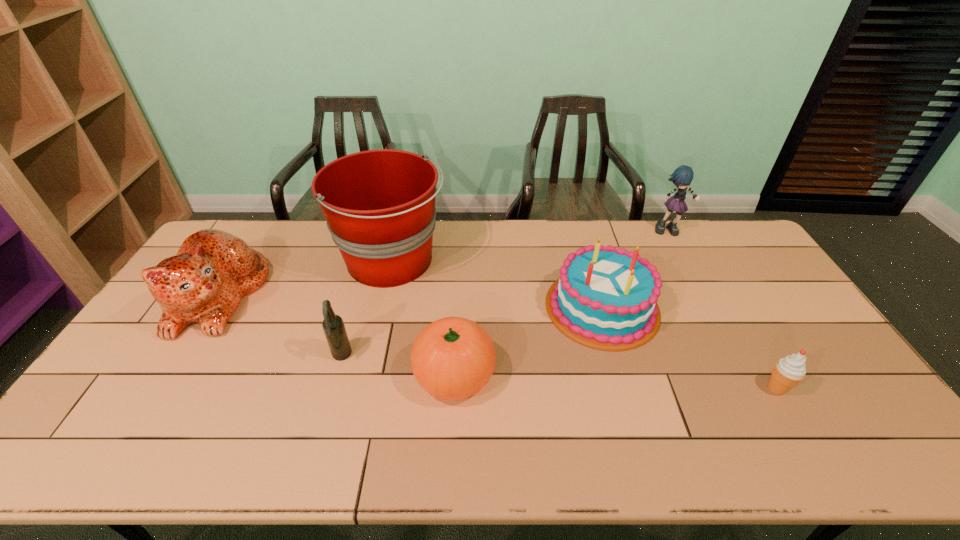
At what (x,y) coordinates should I click in order to perform the action: click on bucket. Please return your answer as a coordinate pair (x, y). The height and width of the screenshot is (540, 960). Looking at the image, I should click on (379, 205).

Locate an element on the screen. Image resolution: width=960 pixels, height=540 pixels. rag doll is located at coordinates (682, 177).

You are a GUI agent. You are given a task and a screenshot of the screen. Output one action in this format:
    pyautogui.click(x=<x>, y=<y>)
    Task: Click on the leftmost object
    This screenshot has width=960, height=540.
    Given the screenshot: What is the action you would take?
    pyautogui.click(x=203, y=283)

Image resolution: width=960 pixels, height=540 pixels. I want to click on the fifth object from left to right, so pyautogui.click(x=604, y=297).

Where is `beer bottle`? The width and height of the screenshot is (960, 540). beer bottle is located at coordinates (333, 326).

Where is `pumpkin`? pumpkin is located at coordinates 452,358.

Identify the location of the shortest object. (789, 371).

Where is `vacant area situated on the right of the bucket`? The height and width of the screenshot is (540, 960). vacant area situated on the right of the bucket is located at coordinates (492, 261).

Find the location of a particular element. free space located 0.080m on the front-facing side of the rag doll is located at coordinates (682, 251).

You are a GUI agent. You are given a task and a screenshot of the screen. Output one action in this format:
    pyautogui.click(x=<x>, y=<y>)
    Task: Click on the free location located 0.140m on the face of the leftmost object
    This screenshot has width=960, height=540.
    Given the screenshot: What is the action you would take?
    pyautogui.click(x=304, y=296)